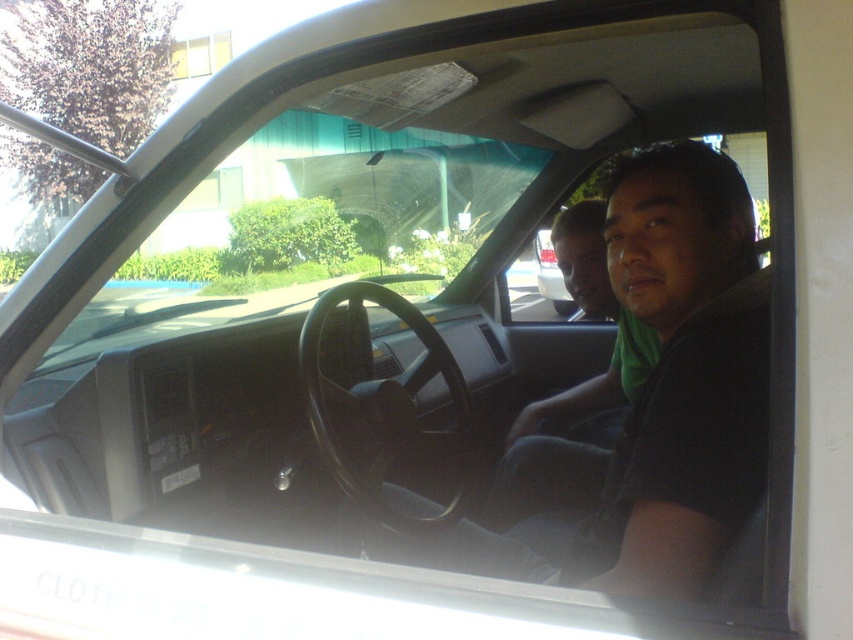
Question: Does black matte shirt at center come in front of matte black shirt at center?

Choices:
 (A) yes
 (B) no

Answer: (A)

Question: Is black matte shirt at center to the right of matte black shirt at center from the viewer's perspective?

Choices:
 (A) yes
 (B) no

Answer: (B)

Question: Which object is closer to the camera taking this photo?

Choices:
 (A) matte black shirt at center
 (B) black matte shirt at center

Answer: (B)

Question: In this image, where is black matte shirt at center located relative to matte black shirt at center?

Choices:
 (A) above
 (B) below

Answer: (B)